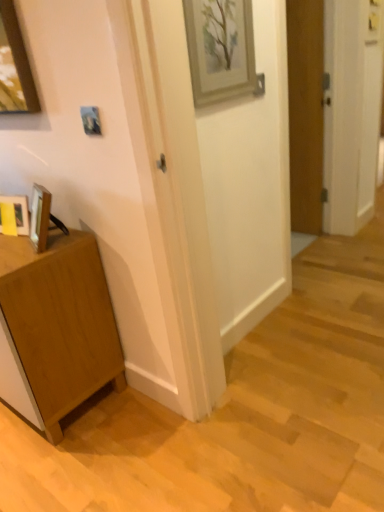
Image resolution: width=384 pixels, height=512 pixels. What do you see at coordinates (60, 322) in the screenshot? I see `light brown wood cabinet at lower left` at bounding box center [60, 322].

The width and height of the screenshot is (384, 512). I want to click on light brown wood cabinet at lower left, so click(x=60, y=322).

Where is `metallic silver picture frame at upper center, the second picture frame when ordered from top to bottom`? The height and width of the screenshot is (512, 384). metallic silver picture frame at upper center, the second picture frame when ordered from top to bottom is located at coordinates (91, 120).

Measure the distance between wooden framed picture at upper center, positioned as the third picture frame in bottom-to-top order, and camera.

wooden framed picture at upper center, positioned as the third picture frame in bottom-to-top order, is 1.42 meters away from camera.

At what (x,y) coordinates should I click in order to perform the action: click on wooden door at right. Please return your answer as a coordinate pair (x, y). The width and height of the screenshot is (384, 512). Looking at the image, I should click on (306, 112).

Considering the relative sizes of matte wooden picture frame at lower left, arranged as the third picture frame when viewed from the top, and metallic silver picture frame at upper center, which ranks as the second picture frame in left-to-right order, in the image provided, is matte wooden picture frame at lower left, arranged as the third picture frame when viewed from the top, bigger than metallic silver picture frame at upper center, which ranks as the second picture frame in left-to-right order,?

Yes, matte wooden picture frame at lower left, arranged as the third picture frame when viewed from the top, is bigger than metallic silver picture frame at upper center, which ranks as the second picture frame in left-to-right order.

Considering the relative positions of matte wooden picture frame at lower left, which ranks as the first picture frame in bottom-to-top order, and metallic silver picture frame at upper center, the second picture frame from the right, in the image provided, is matte wooden picture frame at lower left, which ranks as the first picture frame in bottom-to-top order, to the left or to the right of metallic silver picture frame at upper center, the second picture frame from the right,?

In the image, matte wooden picture frame at lower left, which ranks as the first picture frame in bottom-to-top order, appears on the left side of metallic silver picture frame at upper center, the second picture frame from the right.

Find the location of a particular element. The image size is (384, 512). the 1st picture frame to the right when counting from the matte wooden picture frame at lower left, the 3th picture frame in the right-to-left sequence is located at coordinates (91, 120).

Is matte wooden picture frame at lower left, the first picture frame in the left-to-right sequence, next to metallic silver picture frame at upper center, the second picture frame from the right?

matte wooden picture frame at lower left, the first picture frame in the left-to-right sequence, and metallic silver picture frame at upper center, the second picture frame from the right, are not in contact.

How different are the orientations of metallic silver picture frame at upper center, the second picture frame when ordered from top to bottom, and wooden door at right in degrees?

The angular difference between metallic silver picture frame at upper center, the second picture frame when ordered from top to bottom, and wooden door at right is 5.74 degrees.

Is metallic silver picture frame at upper center, which ranks as the second picture frame in left-to-right order, turned away from wooden door at right?

A: Absolutely, metallic silver picture frame at upper center, which ranks as the second picture frame in left-to-right order, is directed away from wooden door at right.

Is point (96, 124) in front of point (293, 94)?

Yes, it is in front of point (293, 94).

Can you confirm if metallic silver picture frame at upper center, the second picture frame from the right, is thinner than wooden door at right?

Yes.

Would you say wooden framed picture at upper center, which appears as the 1th picture frame when viewed from the top, is part of light brown wood cabinet at lower left's contents?

No, wooden framed picture at upper center, which appears as the 1th picture frame when viewed from the top, is not inside light brown wood cabinet at lower left.

Which object is further away from the camera, light brown wood cabinet at lower left or wooden framed picture at upper center, which is the first picture frame from right to left?

wooden framed picture at upper center, which is the first picture frame from right to left, is behind.

Between light brown wood cabinet at lower left and wooden framed picture at upper center, which is the first picture frame from right to left, which one has less height?

wooden framed picture at upper center, which is the first picture frame from right to left, is shorter.

From a real-world perspective, does light brown wood cabinet at lower left stand above wooden framed picture at upper center, which appears as the 1th picture frame when viewed from the top?

No.

Who is shorter, metallic silver picture frame at upper center, the second picture frame from the right, or matte wooden picture frame at lower left, arranged as the third picture frame when viewed from the top?

metallic silver picture frame at upper center, the second picture frame from the right.

Locate an element on the screen. Image resolution: width=384 pixels, height=512 pixels. picture frame below the metallic silver picture frame at upper center, positioned as the 2th picture frame in bottom-to-top order (from the image's perspective) is located at coordinates (19, 212).

From the image's perspective, which one is positioned lower, metallic silver picture frame at upper center, which ranks as the second picture frame in left-to-right order, or matte wooden picture frame at lower left, the 3th picture frame in the right-to-left sequence?

matte wooden picture frame at lower left, the 3th picture frame in the right-to-left sequence, from the image's perspective.

Is point (198, 74) positioned behind point (87, 283)?

No, it is in front of (87, 283).

Is light brown wood cabinet at lower left at the back of wooden framed picture at upper center, which is the first picture frame from right to left?

No, wooden framed picture at upper center, which is the first picture frame from right to left, is not facing away from light brown wood cabinet at lower left.

Is wooden framed picture at upper center, positioned as the third picture frame in bottom-to-top order, bigger or smaller than light brown wood cabinet at lower left?

In the image, wooden framed picture at upper center, positioned as the third picture frame in bottom-to-top order, appears to be smaller than light brown wood cabinet at lower left.

Choose the correct answer: Is wooden door at right inside light brown wood cabinet at lower left or outside it?

wooden door at right is not inside light brown wood cabinet at lower left, it's outside.

How much distance is there between wooden door at right and light brown wood cabinet at lower left?

wooden door at right and light brown wood cabinet at lower left are 1.91 meters apart.

Considering the relative positions of wooden door at right and light brown wood cabinet at lower left in the image provided, is wooden door at right behind light brown wood cabinet at lower left?

Yes.

From the picture: Considering the sizes of objects wooden door at right and light brown wood cabinet at lower left in the image provided, who is wider, wooden door at right or light brown wood cabinet at lower left?

With larger width is light brown wood cabinet at lower left.

Is wooden door at right not near matte wooden picture frame at lower left, the 3th picture frame in the right-to-left sequence?

Yes, wooden door at right and matte wooden picture frame at lower left, the 3th picture frame in the right-to-left sequence, are quite far apart.

From the image's perspective, is wooden door at right above or below matte wooden picture frame at lower left, the first picture frame in the left-to-right sequence?

Clearly, from the image's perspective, wooden door at right is above matte wooden picture frame at lower left, the first picture frame in the left-to-right sequence.

Between wooden door at right and matte wooden picture frame at lower left, arranged as the third picture frame when viewed from the top, which one has larger width?

matte wooden picture frame at lower left, arranged as the third picture frame when viewed from the top, is wider.

In order to click on the 1st picture frame directly above the matte wooden picture frame at lower left, arranged as the third picture frame when viewed from the top (from a real-world perspective) in this screenshot , I will do `click(91, 120)`.

Locate an element on the screen. The height and width of the screenshot is (512, 384). door on the right of metallic silver picture frame at upper center, positioned as the 2th picture frame in bottom-to-top order is located at coordinates (306, 112).

Estimate the real-world distances between objects in this image. Which object is closer to light brown wood cabinet at lower left, wooden framed picture at upper center, positioned as the 3th picture frame in left-to-right order, or metallic silver picture frame at upper center, which ranks as the second picture frame in left-to-right order?

Based on the image, metallic silver picture frame at upper center, which ranks as the second picture frame in left-to-right order, appears to be nearer to light brown wood cabinet at lower left.

Estimate the real-world distances between objects in this image. Which object is further from light brown wood cabinet at lower left, metallic silver picture frame at upper center, the second picture frame from the right, or wooden framed picture at upper center, positioned as the third picture frame in bottom-to-top order?

wooden framed picture at upper center, positioned as the third picture frame in bottom-to-top order, is positioned further to the anchor light brown wood cabinet at lower left.

Considering their positions, is wooden door at right positioned closer to matte wooden picture frame at lower left, arranged as the third picture frame when viewed from the top, than wooden framed picture at upper center, which appears as the 1th picture frame when viewed from the top?

wooden framed picture at upper center, which appears as the 1th picture frame when viewed from the top, is closer to matte wooden picture frame at lower left, arranged as the third picture frame when viewed from the top.

Based on their spatial positions, is light brown wood cabinet at lower left or wooden framed picture at upper center, positioned as the third picture frame in bottom-to-top order, closer to matte wooden picture frame at lower left, the 3th picture frame in the right-to-left sequence?

The object closer to matte wooden picture frame at lower left, the 3th picture frame in the right-to-left sequence, is light brown wood cabinet at lower left.

Based on their spatial positions, is wooden framed picture at upper center, positioned as the third picture frame in bottom-to-top order, or wooden door at right closer to matte wooden picture frame at lower left, which ranks as the first picture frame in bottom-to-top order?

wooden framed picture at upper center, positioned as the third picture frame in bottom-to-top order, is closer to matte wooden picture frame at lower left, which ranks as the first picture frame in bottom-to-top order.

Looking at the image, which one is located further to light brown wood cabinet at lower left, metallic silver picture frame at upper center, which ranks as the second picture frame in left-to-right order, or wooden door at right?

The object further to light brown wood cabinet at lower left is wooden door at right.

Estimate the real-world distances between objects in this image. Which object is further from wooden door at right, light brown wood cabinet at lower left or metallic silver picture frame at upper center, the second picture frame when ordered from top to bottom?

light brown wood cabinet at lower left is further to wooden door at right.

Looking at the image, which one is located closer to light brown wood cabinet at lower left, matte wooden picture frame at lower left, the 3th picture frame in the right-to-left sequence, or wooden framed picture at upper center, which appears as the 1th picture frame when viewed from the top?

Among the two, matte wooden picture frame at lower left, the 3th picture frame in the right-to-left sequence, is located nearer to light brown wood cabinet at lower left.

The image size is (384, 512). I want to click on picture frame between matte wooden picture frame at lower left, the first picture frame in the left-to-right sequence, and wooden framed picture at upper center, which appears as the 1th picture frame when viewed from the top, from left to right, so click(91, 120).

The height and width of the screenshot is (512, 384). I want to click on picture frame between metallic silver picture frame at upper center, the second picture frame when ordered from top to bottom, and light brown wood cabinet at lower left, in the vertical direction, so click(19, 212).